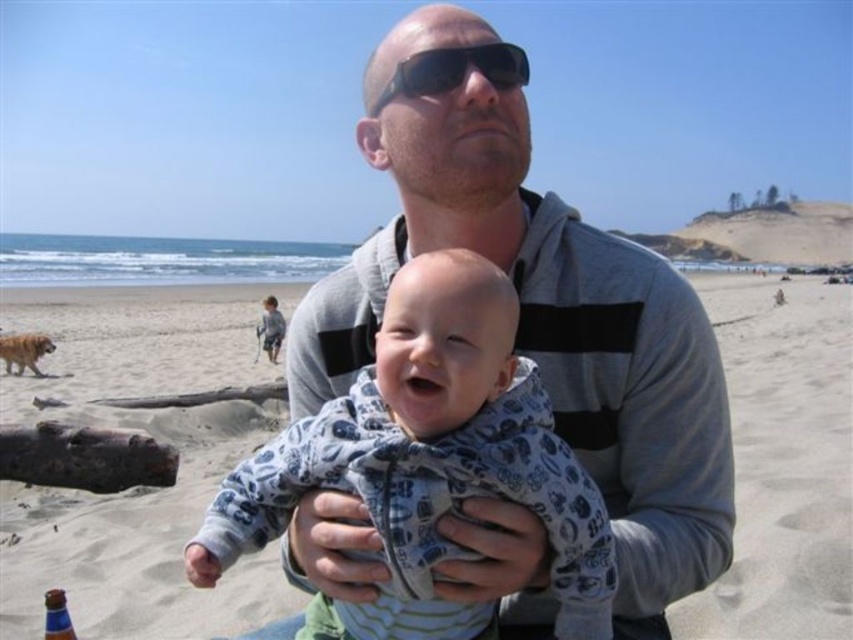
How far apart are gray hoodie at center and blue plastic bottle at lower left?

The distance of gray hoodie at center from blue plastic bottle at lower left is 6.76 feet.

Does gray hoodie at center have a larger size compared to blue plastic bottle at lower left?

Indeed, gray hoodie at center has a larger size compared to blue plastic bottle at lower left.

Is point (633, 339) positioned behind point (55, 636)?

No, (633, 339) is closer to viewer.

Locate an element on the screen. gray hoodie at center is located at coordinates (543, 317).

Between point (392, 230) and point (480, 65), which one is positioned in front?

Point (480, 65)

Which is more to the left, gray hoodie at center or black plastic sunglasses at upper center?

black plastic sunglasses at upper center

Between point (543, 637) and point (416, 83), which one is positioned in front?

Point (543, 637) is in front.

Identify the location of gray hoodie at center. pos(543,317).

Can you confirm if gray hoodie at center is wider than blue cotton onesie at center?

Yes, gray hoodie at center is wider than blue cotton onesie at center.

Locate an element on the screen. The image size is (853, 640). gray hoodie at center is located at coordinates (543, 317).